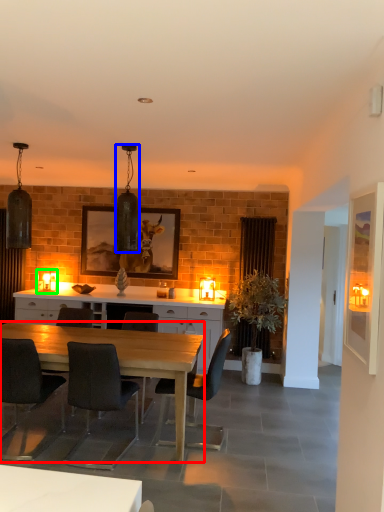
Question: Based on their relative distances, which object is nearer to desk (highlighted by a red box)? Choose from lamp (highlighted by a blue box) and lamp (highlighted by a green box).

Choices:
 (A) lamp
 (B) lamp

Answer: (A)